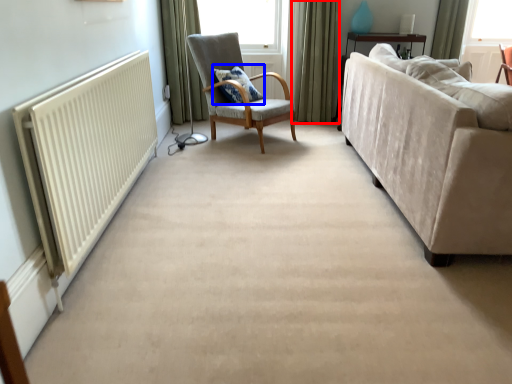
Question: Which object appears farthest to the camera in this image, curtain (highlighted by a red box) or pillow (highlighted by a blue box)?

Choices:
 (A) curtain
 (B) pillow

Answer: (A)